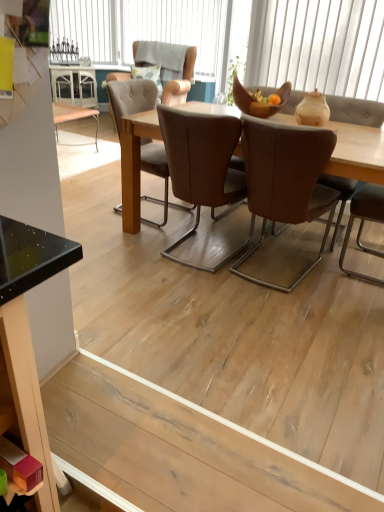
Find the location of a particular element. free space above natural wood floor at lower center (from a real-world perspective) is located at coordinates (153, 439).